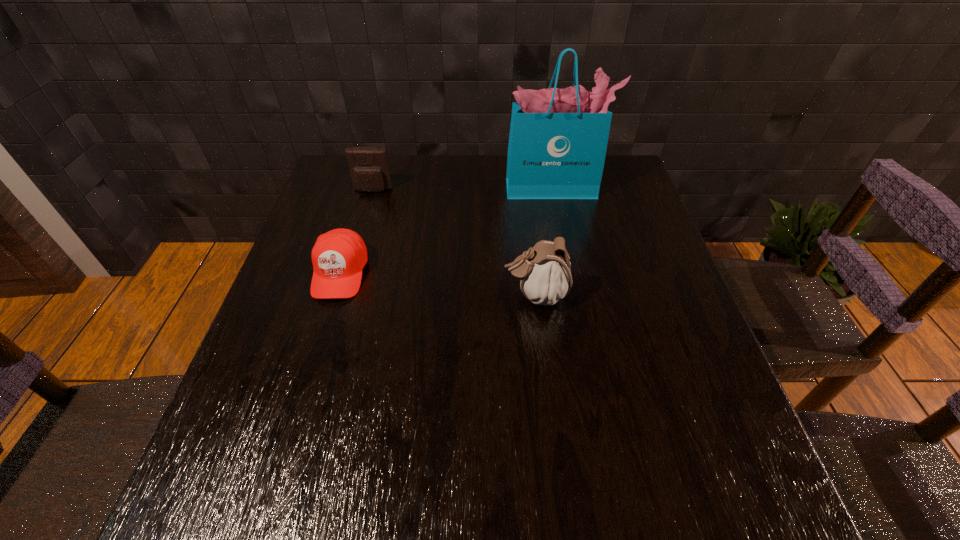
Where is `shopping bag`? shopping bag is located at coordinates (558, 138).

The width and height of the screenshot is (960, 540). Find the location of `the taller pouch`. the taller pouch is located at coordinates (545, 277).

Where is `the third shortest object`? The image size is (960, 540). the third shortest object is located at coordinates (545, 277).

Find the location of a particular element. Image resolution: width=960 pixels, height=540 pixels. the farther pouch is located at coordinates (369, 168).

Where is `the shorter pouch`? the shorter pouch is located at coordinates 369,168.

You are a GUI agent. You are given a task and a screenshot of the screen. Output one action in this format:
    pyautogui.click(x=<x>, y=<y>)
    Task: Click on the baseball cap
    The image size is (960, 540).
    Given the screenshot: What is the action you would take?
    pyautogui.click(x=338, y=257)

Image resolution: width=960 pixels, height=540 pixels. I want to click on vacant point located on the left of the shopping bag, so click(x=443, y=188).

Find the location of `blank space located 0.250m on the front-facing side of the nearer pouch`. blank space located 0.250m on the front-facing side of the nearer pouch is located at coordinates click(395, 295).

At what (x,y) coordinates should I click in order to perform the action: click on vacant space situated on the front-facing side of the nearer pouch. Please return your answer as a coordinate pair (x, y). Looking at the image, I should click on [460, 295].

Where is `free location located on the front-facing side of the nearer pouch`? This screenshot has height=540, width=960. free location located on the front-facing side of the nearer pouch is located at coordinates (390, 295).